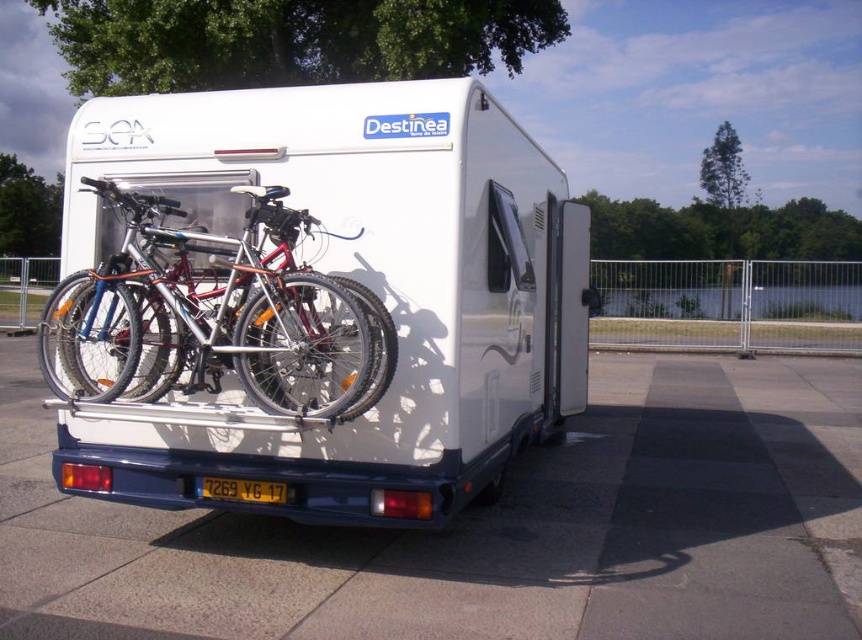
How far apart are silver metallic bicycle at center and yellow matte license plate at center?

silver metallic bicycle at center and yellow matte license plate at center are 34.83 inches apart.

Who is more forward, (378, 372) or (284, 500)?

Point (378, 372) is in front.

This screenshot has height=640, width=862. What do you see at coordinates (216, 314) in the screenshot? I see `silver metallic bicycle at center` at bounding box center [216, 314].

Identify the location of silver metallic bicycle at center. (216, 314).

Can you confirm if white glossy van at center is positioned below yellow matte license plate at center?

No.

Is point (369, 440) in front of point (258, 493)?

That is False.

Is point (563, 216) closer to viewer compared to point (219, 486)?

No, it is not.

Image resolution: width=862 pixels, height=640 pixels. Identify the location of white glossy van at center. (355, 280).

Can you confirm if white glossy van at center is taller than silver metallic bicycle at center?

Yes.

Is point (554, 164) positioned in front of point (273, 314)?

No, (554, 164) is behind (273, 314).

Which is behind, point (420, 440) or point (189, 305)?

The point (189, 305) is behind.

Where is `white glossy van at center`? This screenshot has width=862, height=640. white glossy van at center is located at coordinates (355, 280).